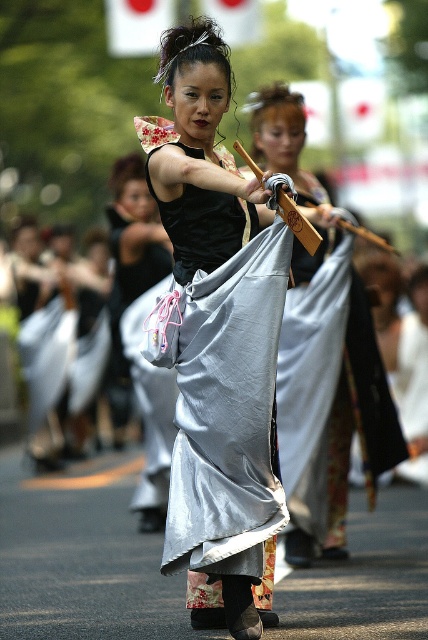
Is satin silver kimono at center smaller than silvery fabric skirt at center?

Indeed, satin silver kimono at center has a smaller size compared to silvery fabric skirt at center.

Is point (139, 125) closer to camera compared to point (124, 256)?

Yes, it is.

At what (x,y) coordinates should I click in order to perform the action: click on satin silver kimono at center. Please return your answer as a coordinate pair (x, y). The width and height of the screenshot is (428, 640). Looking at the image, I should click on (205, 321).

Does satin silver kimono at center have a greater height compared to silvery satin kimono at center?

Indeed, satin silver kimono at center has a greater height compared to silvery satin kimono at center.

In the scene shown: Does satin silver kimono at center have a smaller size compared to silvery satin kimono at center?

Actually, satin silver kimono at center might be larger than silvery satin kimono at center.

Locate an element on the screen. The height and width of the screenshot is (640, 428). satin silver kimono at center is located at coordinates (205, 321).

Can you confirm if silvery satin kimono at center is bigger than silvery fabric skirt at center?

Incorrect, silvery satin kimono at center is not larger than silvery fabric skirt at center.

Which is below, silvery satin kimono at center or silvery fabric skirt at center?

silvery satin kimono at center is lower down.

Image resolution: width=428 pixels, height=640 pixels. I want to click on silvery satin kimono at center, so click(323, 355).